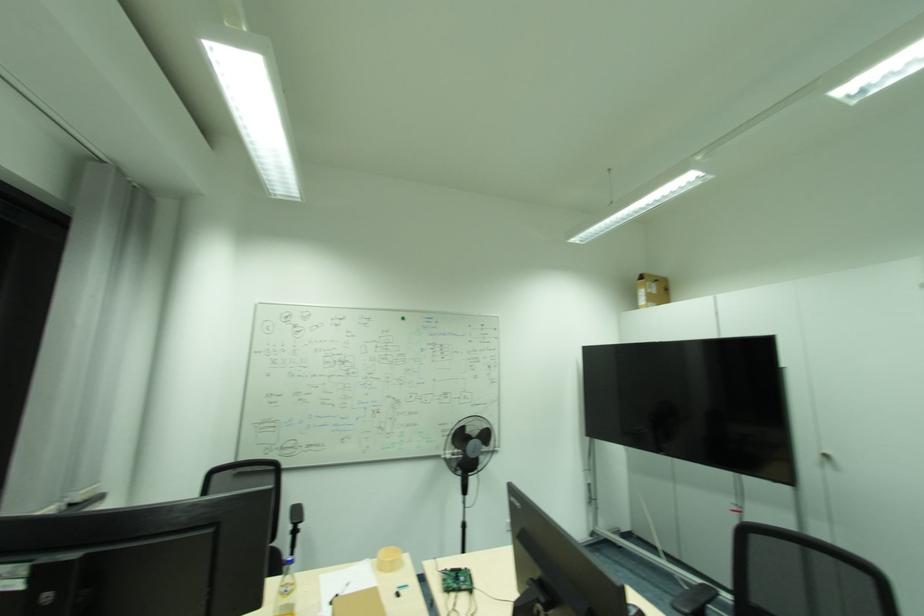
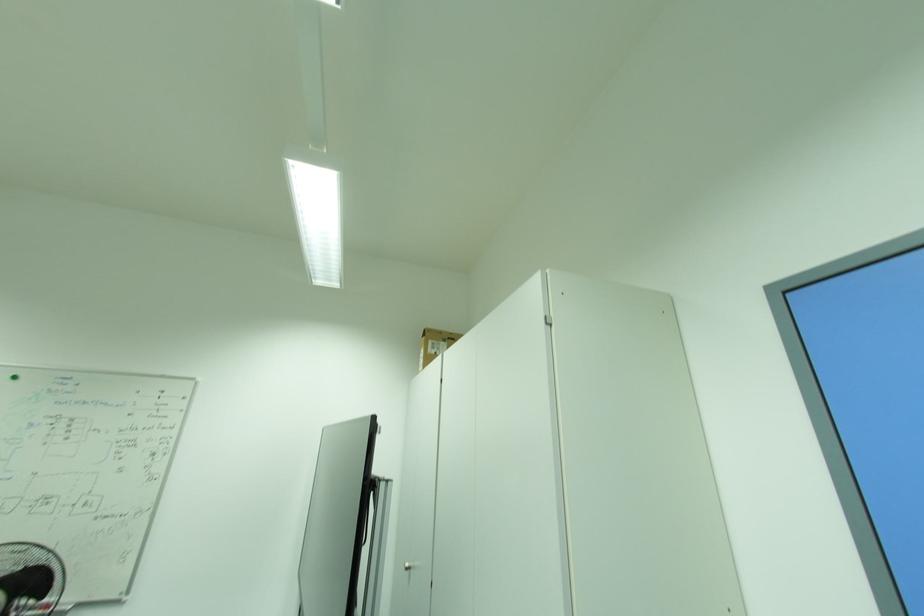
Looking at this image, the images are taken continuously from a first-person perspective. In which direction are you moving?

The cameraman walked toward right, forward.